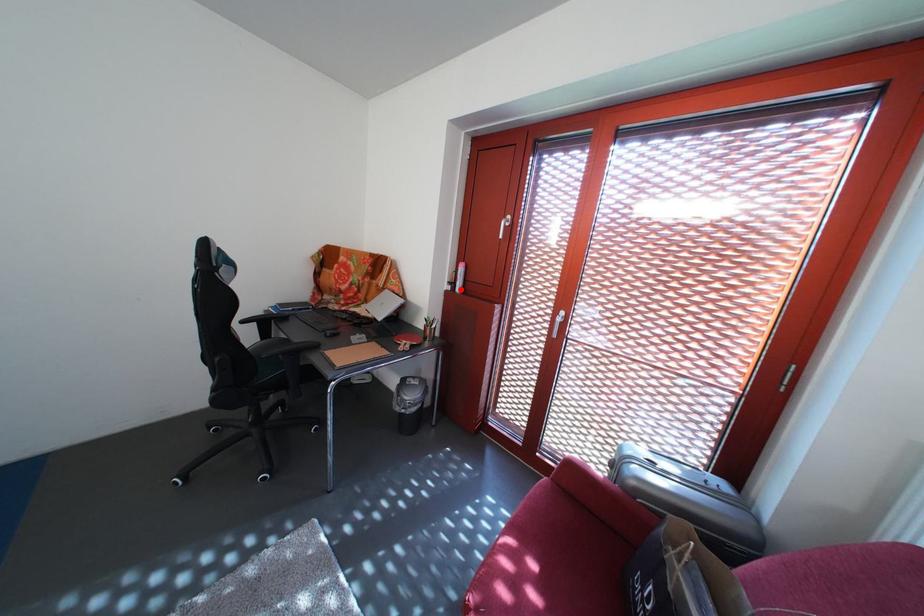
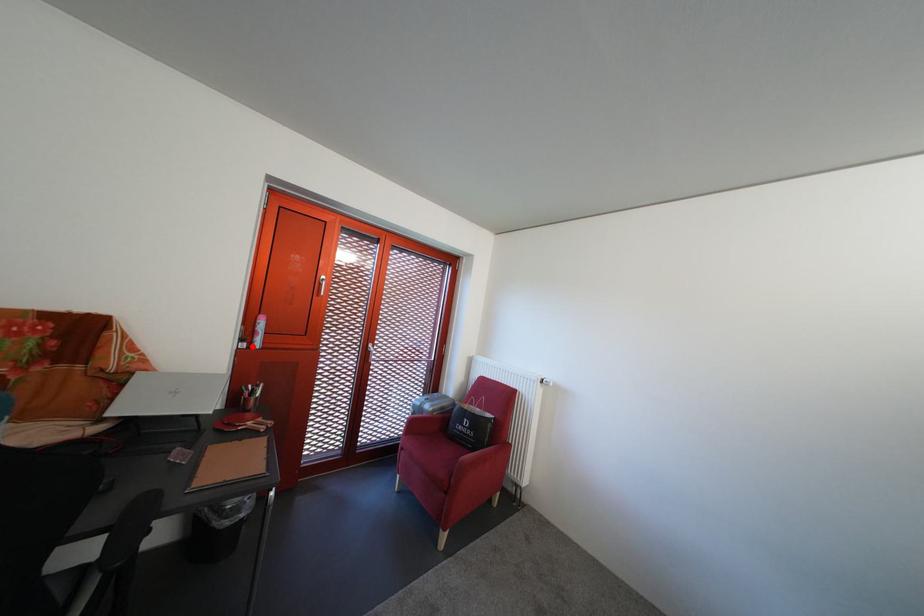
Looking at this image, I am providing you with two images of the same scene from different viewpoints. A red point is marked on the first image and another point is marked on the second image. Is the red point in image1 aligned with the point shown in image2?

Yes